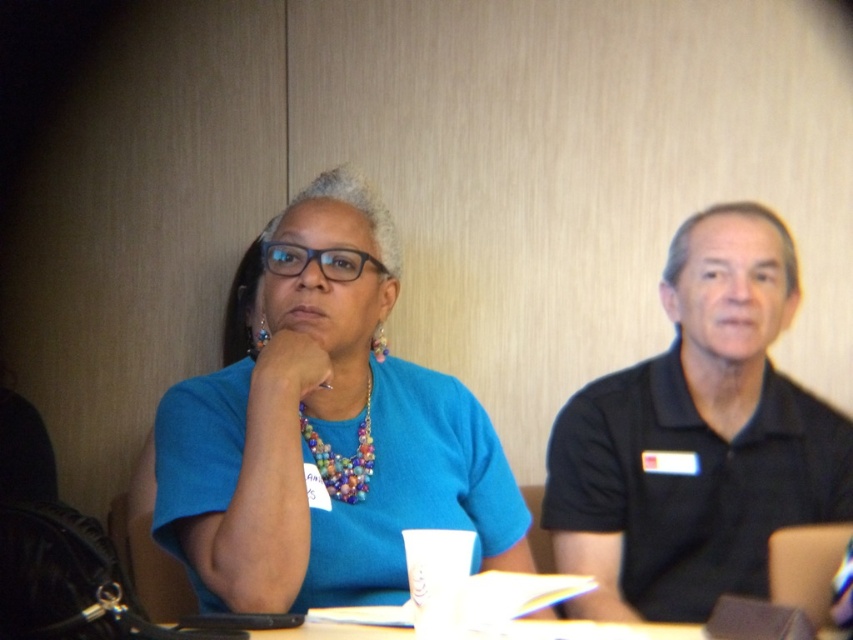
Who is more distant from viewer, (553, 515) or (363, 419)?

Point (553, 515)

What do you see at coordinates (695, 436) in the screenshot? The width and height of the screenshot is (853, 640). I see `black polo shirt at right` at bounding box center [695, 436].

Find the location of a particular element. Image resolution: width=853 pixels, height=640 pixels. black polo shirt at right is located at coordinates (695, 436).

Is blue fabric shirt at center thinner than transparent plastic glasses at center?

Incorrect, blue fabric shirt at center's width is not less than transparent plastic glasses at center's.

From the picture: Which of these two, blue fabric shirt at center or transparent plastic glasses at center, stands taller?

With more height is blue fabric shirt at center.

Does point (373, 413) come closer to viewer compared to point (347, 257)?

That is False.

This screenshot has height=640, width=853. In order to click on blue fabric shirt at center in this screenshot , I will do `click(325, 440)`.

Is point (457, 529) positioned behind point (804, 394)?

No.

What are the coordinates of `blue fabric shirt at center` in the screenshot? It's located at (325, 440).

Between point (436, 384) and point (634, 602), which one is positioned in front?

Point (436, 384) is in front.

At what (x,y) coordinates should I click in order to perform the action: click on blue fabric shirt at center. Please return your answer as a coordinate pair (x, y). This screenshot has width=853, height=640. Looking at the image, I should click on (325, 440).